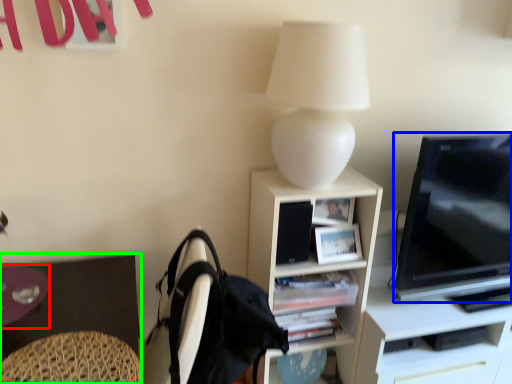
Question: Estimate the real-world distances between objects in this image. Which object is closer to glass table (highlighted by a red box), television (highlighted by a blue box) or desk (highlighted by a green box)?

Choices:
 (A) television
 (B) desk

Answer: (B)